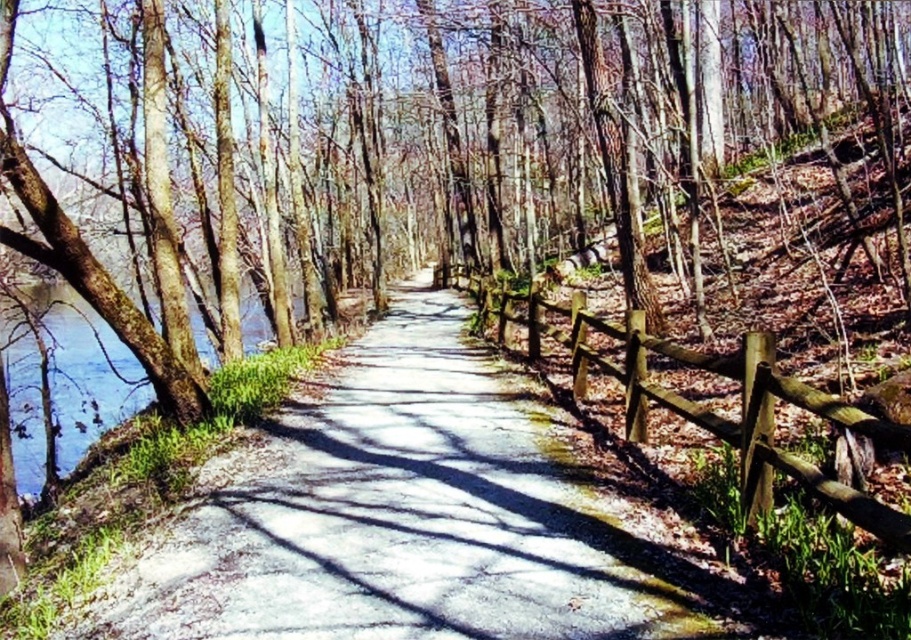
You are planning to walk along the smooth concrete path at center and want to know if you can carry a large backpack with you. Considering the size of the path compared to the brown wooden fence at right, can you walk comfortably with the backpack?

The smooth concrete path at center is bigger than the brown wooden fence at right, so yes, you can walk comfortably with the large backpack on the smooth concrete path at center since it has sufficient width.

You are a hiker walking along the smooth concrete path at center and want to reach the brown wooden fence at right. Which direction should you turn to get there?

To reach the brown wooden fence at right from the smooth concrete path at center, you should turn to your right since the smooth concrete path at center is to the left of the brown wooden fence at right.